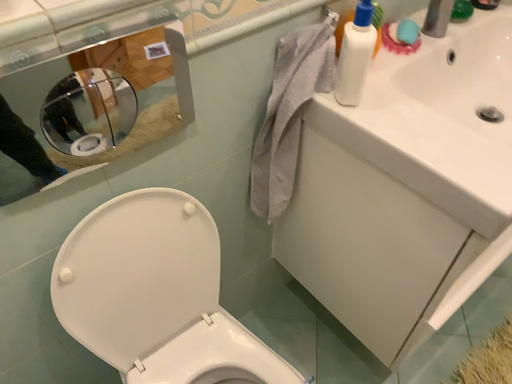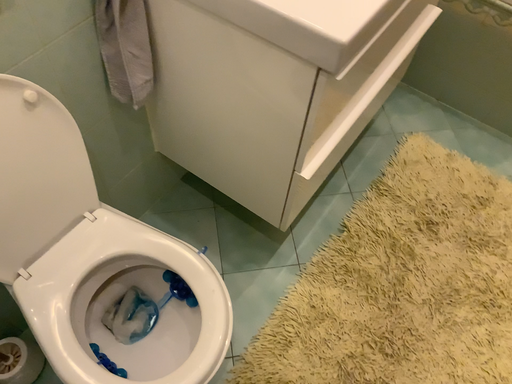
Question: How did the camera likely rotate when shooting the video?

Choices:
 (A) rotated downward
 (B) rotated upward

Answer: (A)